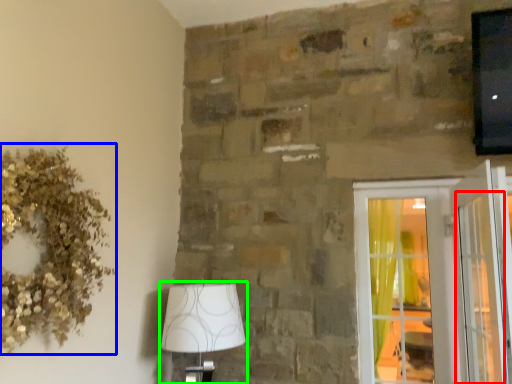
Question: Estimate the real-world distances between objects in this image. Which object is closer to screen door (highlighted by a red box), floral arrangement (highlighted by a blue box) or lamp (highlighted by a green box)?

Choices:
 (A) floral arrangement
 (B) lamp

Answer: (B)